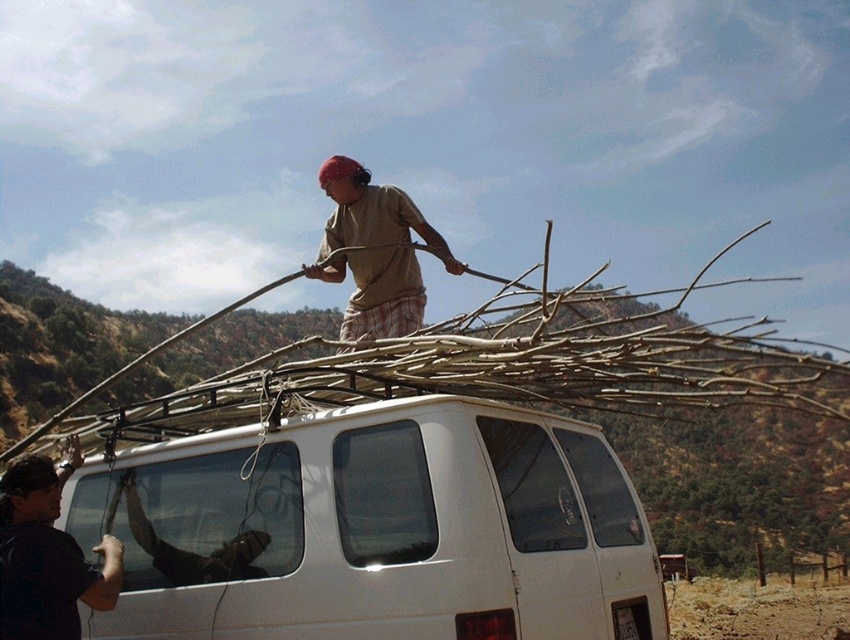
Question: Among these points, which one is farthest from the camera?

Choices:
 (A) (299, 625)
 (B) (771, 356)

Answer: (B)

Question: Does brown dry wood at upper center have a lesser width compared to black fabric at left?

Choices:
 (A) no
 (B) yes

Answer: (A)

Question: Can you confirm if black fabric at left is positioned below brown cotton shirt at center?

Choices:
 (A) no
 (B) yes

Answer: (B)

Question: Which of these objects is positioned farthest from the black fabric at left?

Choices:
 (A) brown cotton shirt at center
 (B) brown dry wood at upper center

Answer: (B)

Question: Does brown dry wood at upper center have a greater width compared to brown cotton shirt at center?

Choices:
 (A) yes
 (B) no

Answer: (A)

Question: Based on their relative distances, which object is farther from the white matte van at center?

Choices:
 (A) black fabric at left
 (B) brown dry wood at upper center
 (C) brown cotton shirt at center

Answer: (B)